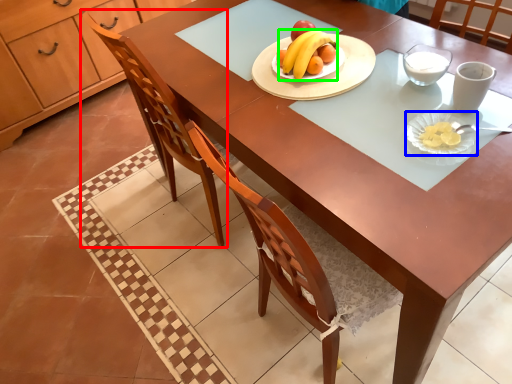
Question: Which object is the closest to the chair (highlighted by a red box)? Choose among these: platter (highlighted by a blue box) or banana (highlighted by a green box).

Choices:
 (A) platter
 (B) banana

Answer: (B)